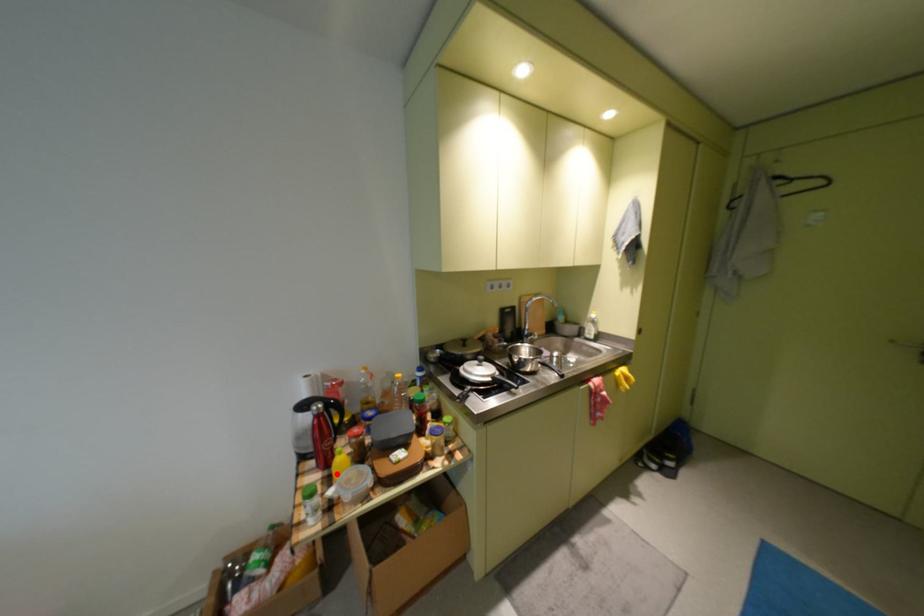
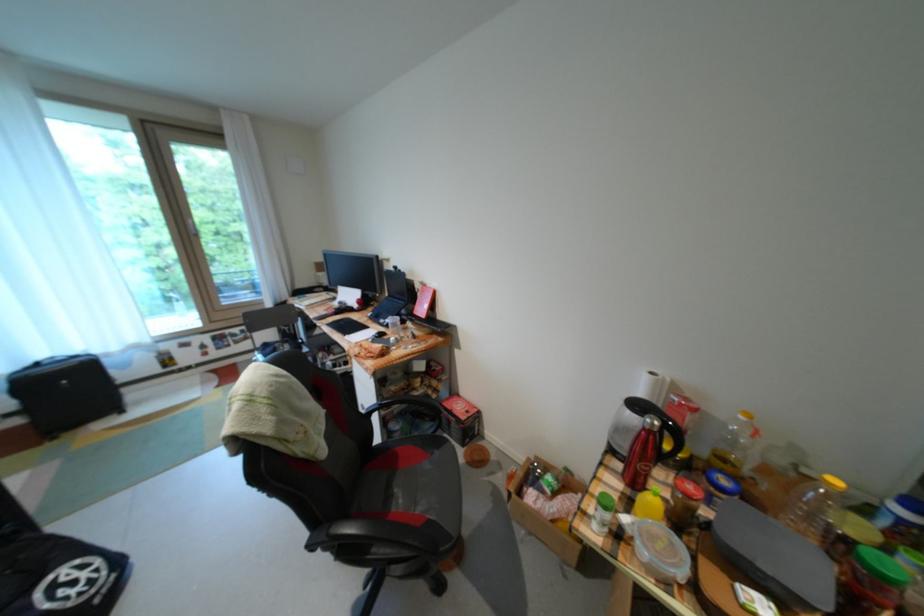
Find the pixel in the second image that matches the highlighted location in the first image.

(639, 493)